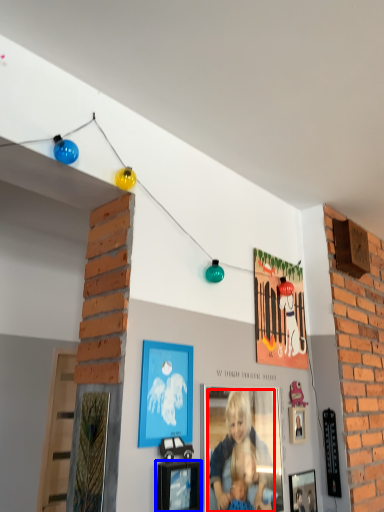
Question: Among these objects, which one is nearest to the camera, person (highlighted by a red box) or picture frame (highlighted by a blue box)?

Choices:
 (A) person
 (B) picture frame

Answer: (B)